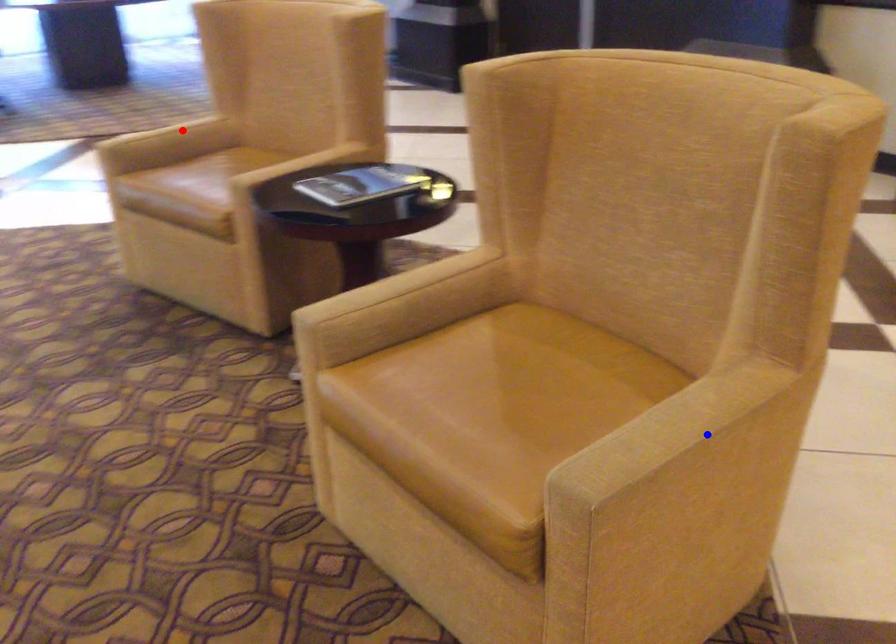
Question: In the image, two points are highlighted. Which point is nearer to the camera? Reply with the corresponding letter.

Choices:
 (A) blue point
 (B) red point

Answer: (A)